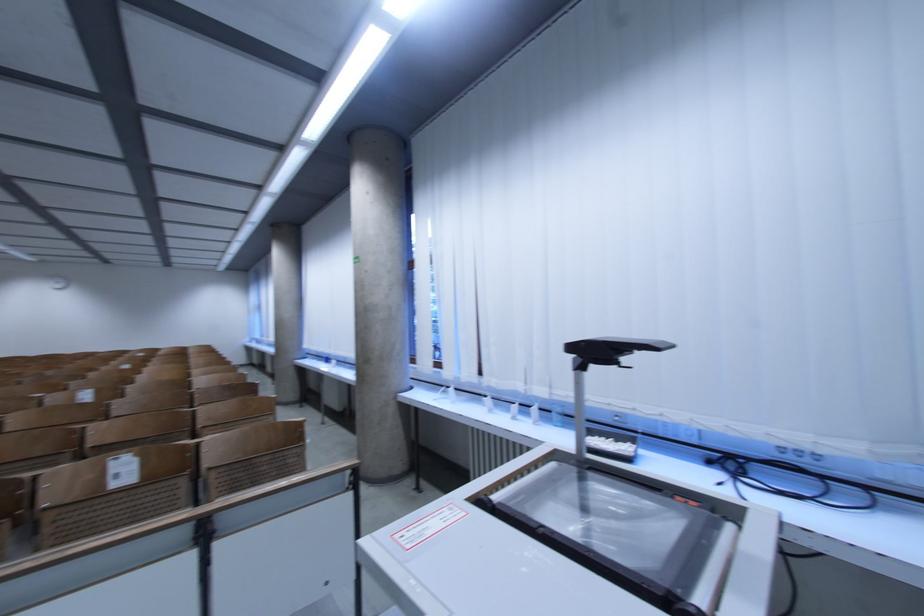
At what (x,y) coordinates should I click in order to perform the action: click on small black tray. Please return your answer as a coordinate pair (x, y). The height and width of the screenshot is (616, 924). Looking at the image, I should click on (612, 446).